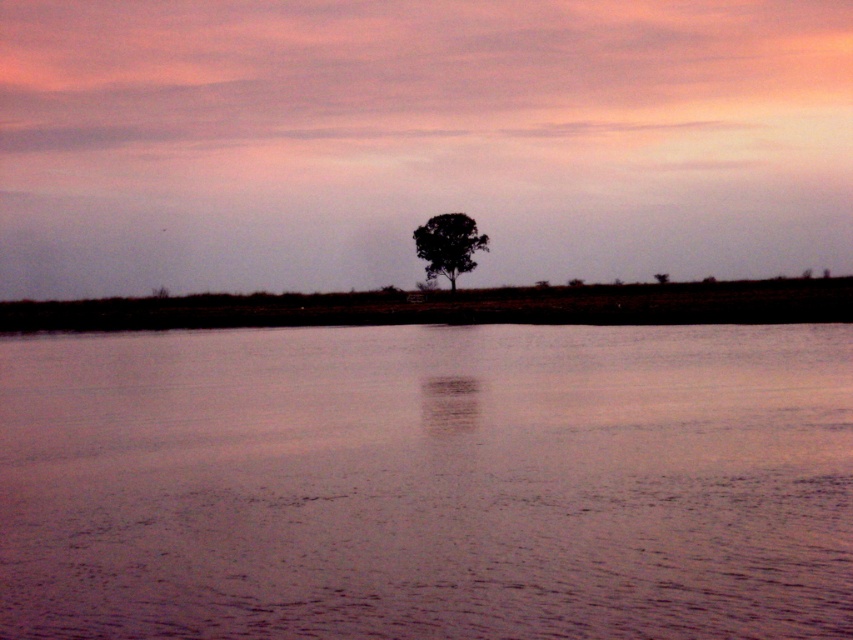
Question: Does smooth water at center appear on the left side of silhouette textured tree at center?

Choices:
 (A) no
 (B) yes

Answer: (B)

Question: Among these points, which one is nearest to the camera?

Choices:
 (A) (798, 560)
 (B) (432, 268)

Answer: (A)

Question: Does smooth water at center appear over silhouette textured tree at center?

Choices:
 (A) yes
 (B) no

Answer: (B)

Question: Is smooth water at center bigger than silhouette textured tree at center?

Choices:
 (A) yes
 (B) no

Answer: (A)